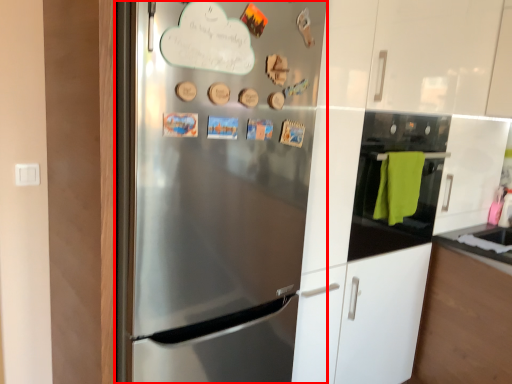
Question: Observing the image, what is the correct spatial positioning of refrigerator (annotated by the red box) in reference to oven?

Choices:
 (A) left
 (B) right

Answer: (A)